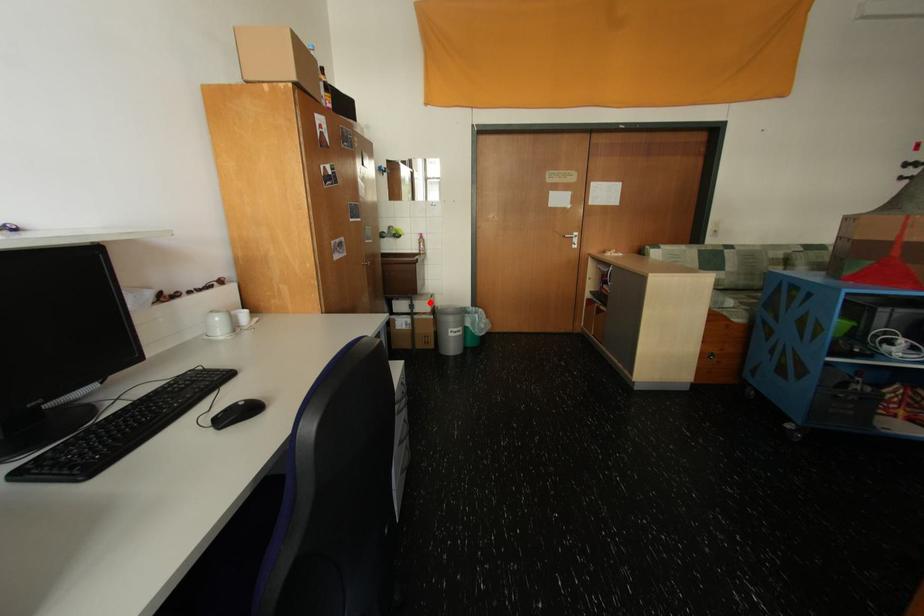
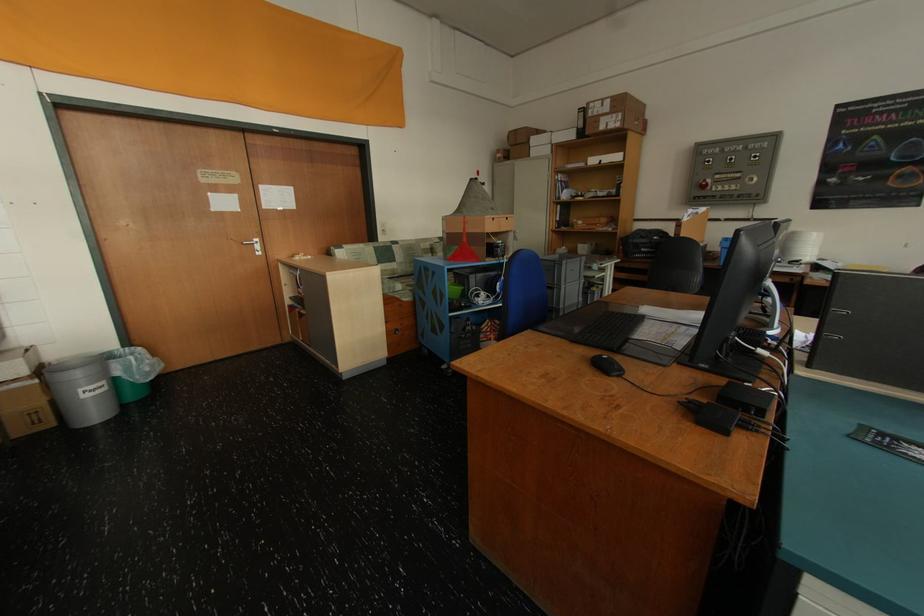
Find the pixel in the second image that matches the highlighted location in the first image.

(10, 363)